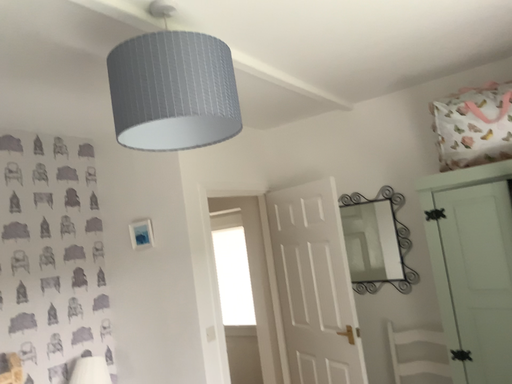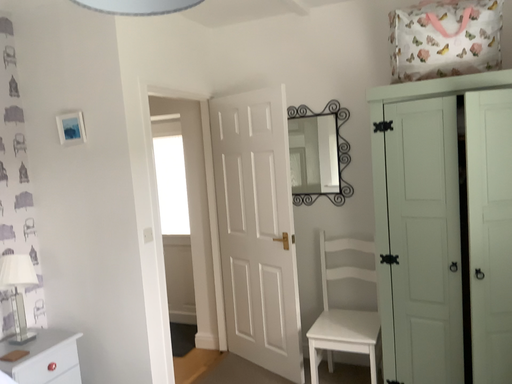
Question: How did the camera likely rotate when shooting the video?

Choices:
 (A) rotated right
 (B) rotated left

Answer: (A)